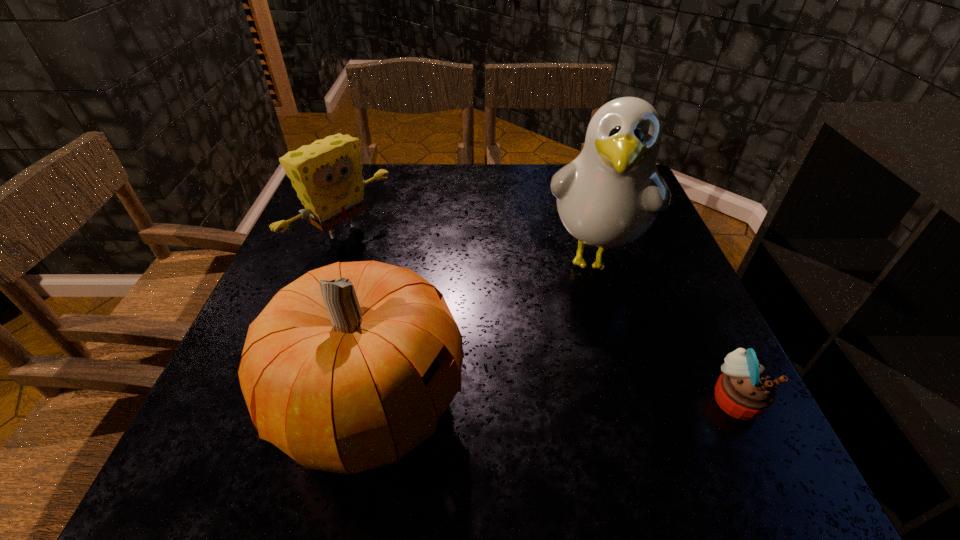
Locate an element on the screen. The width and height of the screenshot is (960, 540). pumpkin is located at coordinates (348, 368).

Where is `muffin`? muffin is located at coordinates (743, 391).

At what (x,y) coordinates should I click in order to perform the action: click on the shortest object. Please return your answer as a coordinate pair (x, y). Looking at the image, I should click on (743, 391).

The image size is (960, 540). I want to click on the tallest object, so click(x=610, y=195).

What are the coordinates of `the third object from left to right` in the screenshot? It's located at (610, 195).

Where is `sponge`? The height and width of the screenshot is (540, 960). sponge is located at coordinates (327, 175).

At what (x,y) coordinates should I click in order to perform the action: click on blank space located 0.070m on the front-facing side of the second tallest object. Please return your answer as a coordinate pair (x, y). Image resolution: width=960 pixels, height=540 pixels. Looking at the image, I should click on (506, 405).

Find the location of a particular element. Image resolution: width=960 pixels, height=540 pixels. free region located on the beak of the tallest object is located at coordinates (576, 376).

What are the coordinates of `free region located 0.050m on the beak of the tallest object` in the screenshot? It's located at [586, 319].

Identify the location of free location located on the beak of the tallest object. pyautogui.click(x=585, y=327).